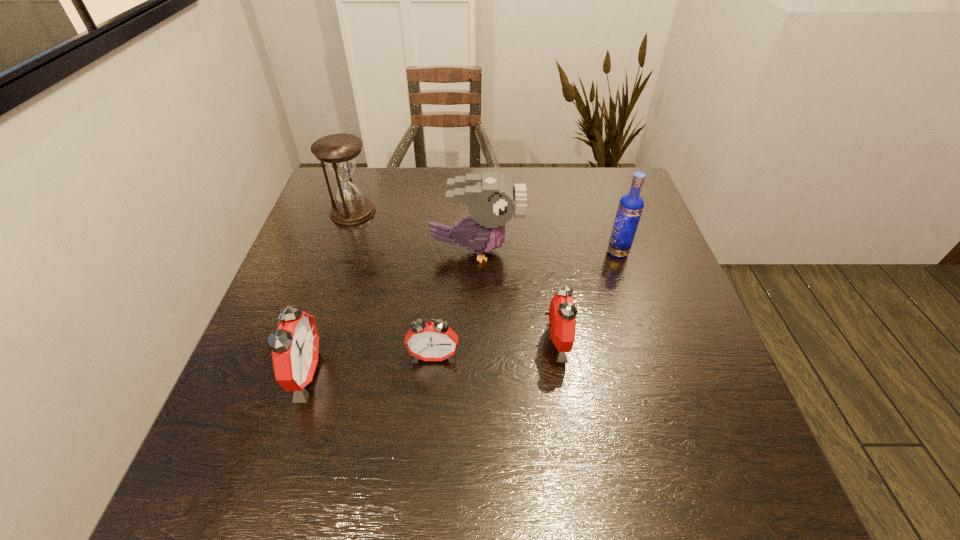
The height and width of the screenshot is (540, 960). What are the coordinates of `the leftmost alarm clock` in the screenshot? It's located at (295, 347).

Locate an element on the screen. the shortest object is located at coordinates (433, 341).

Identify the location of the shortest alarm clock. The image size is (960, 540). (433, 341).

Where is `the rightmost alarm clock`? the rightmost alarm clock is located at coordinates (562, 313).

At what (x,y) coordinates should I click in order to perform the action: click on the second tallest alarm clock. Please return your answer as a coordinate pair (x, y). The image size is (960, 540). Looking at the image, I should click on (562, 313).

At what (x,y) coordinates should I click in order to perform the action: click on hourglass. Please return your answer as a coordinate pair (x, y). Looking at the image, I should click on (339, 151).

What are the coordinates of `bird` in the screenshot? It's located at (491, 198).

The height and width of the screenshot is (540, 960). In order to click on vodka in this screenshot , I will do `click(631, 205)`.

Identify the location of vacant space located on the clock face of the leftmost alarm clock. (475, 374).

Image resolution: width=960 pixels, height=540 pixels. Find the location of `free space located on the clock face of the second alarm clock from left to right`. free space located on the clock face of the second alarm clock from left to right is located at coordinates (427, 431).